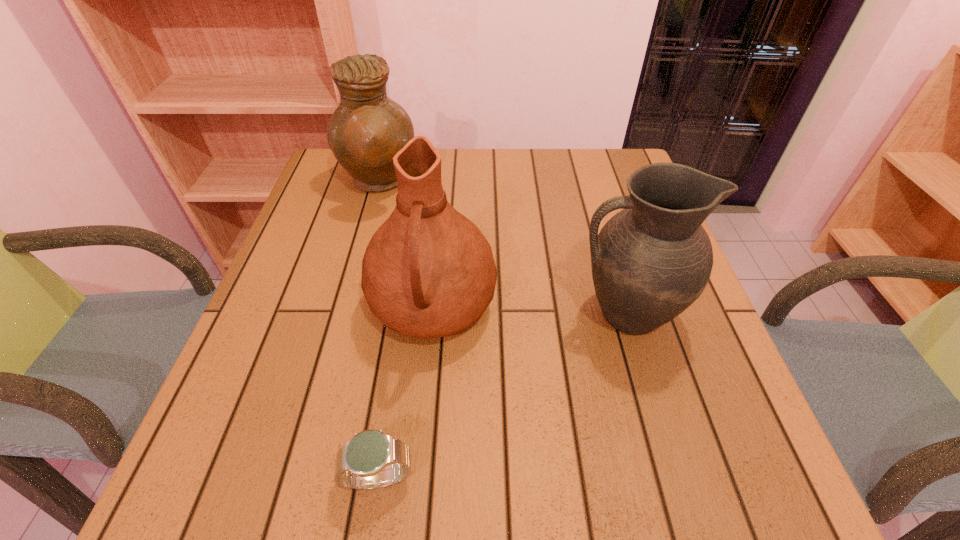
Locate an element on the screen. The height and width of the screenshot is (540, 960). object situated at the near edge is located at coordinates (363, 463).

You are a GUI agent. You are given a task and a screenshot of the screen. Output one action in this format:
    pyautogui.click(x=<x>, y=<y>)
    Task: Click on the object present at the left edge
    
    Given the screenshot: What is the action you would take?
    pyautogui.click(x=367, y=129)

Find the location of `object that is positioned at the right edge`. object that is positioned at the right edge is located at coordinates (653, 259).

This screenshot has width=960, height=540. I want to click on object located in the far left corner section of the desktop, so click(x=367, y=129).

Identify the location of vacant area at the far edge. (544, 150).

You are a GUI agent. You are given a task and a screenshot of the screen. Output one action in this format:
    pyautogui.click(x=<x>, y=<y>)
    Task: Click on the vacant space at the near edge of the desktop
    The width and height of the screenshot is (960, 540).
    Given the screenshot: What is the action you would take?
    pyautogui.click(x=645, y=468)

Where is `vacant space at the left edge of the desktop`? The width and height of the screenshot is (960, 540). vacant space at the left edge of the desktop is located at coordinates (264, 297).

Where is `vacant space at the right edge`? vacant space at the right edge is located at coordinates (746, 439).

In the image, there is a desktop. Where is `vacant space at the near left corner`? The height and width of the screenshot is (540, 960). vacant space at the near left corner is located at coordinates (284, 490).

The height and width of the screenshot is (540, 960). What are the coordinates of `blank space at the far right corner` in the screenshot? It's located at (598, 165).